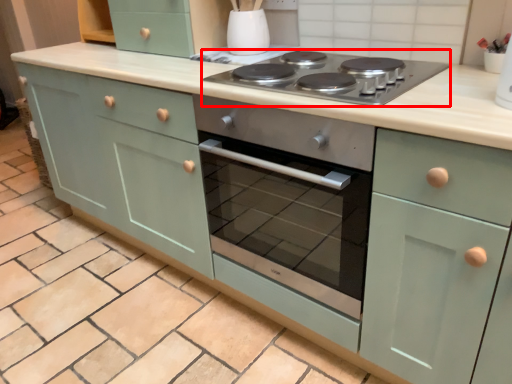
Question: Where is gas stove (annotated by the red box) located in relation to appliance in the image?

Choices:
 (A) left
 (B) right

Answer: (B)